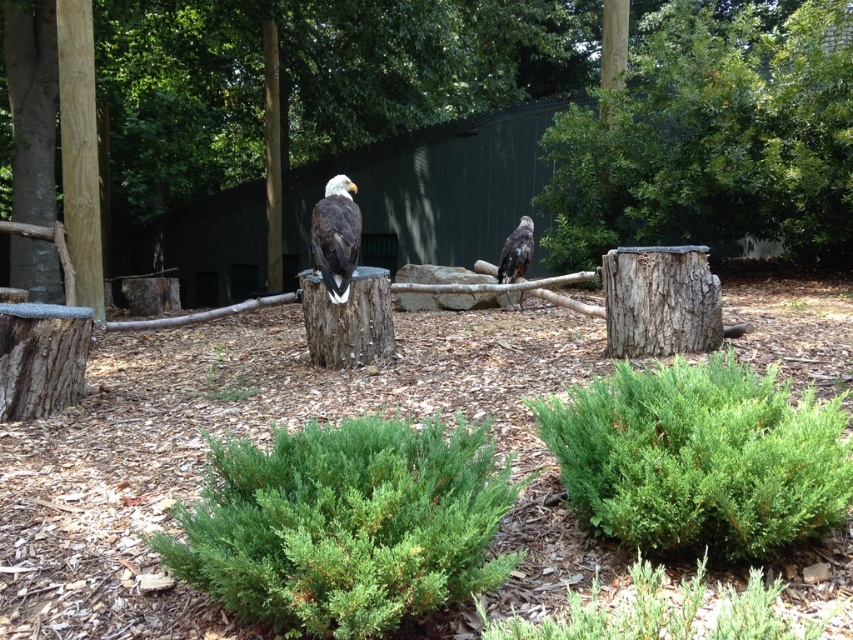
Question: Which of these objects is positioned closest to the green leafy bush at upper right?

Choices:
 (A) green fuzzy bush at lower center
 (B) brown wood pole at center
 (C) smooth bark tree stump at center

Answer: (C)

Question: Which object appears closest to the camera in this image?

Choices:
 (A) green fuzzy bush at lower center
 (B) brown feathered eagle at center
 (C) dark brown feathers at center

Answer: (A)

Question: Is brown rough wood pole at left below dark brown feathers at center?

Choices:
 (A) no
 (B) yes

Answer: (A)

Question: Estimate the real-world distances between objects in this image. Which object is farther from the brown wood pole at center?

Choices:
 (A) dark brown feathers at center
 (B) brown feathered eagle at center
 (C) green leafy bush at lower center
 (D) smooth bark tree stump at center

Answer: (C)

Question: Is brown rough wood pole at left to the left of dark brown feathers at center from the viewer's perspective?

Choices:
 (A) no
 (B) yes

Answer: (B)

Question: Can you confirm if smooth bark tree stump at center is thinner than brown wood pole at center?

Choices:
 (A) yes
 (B) no

Answer: (B)